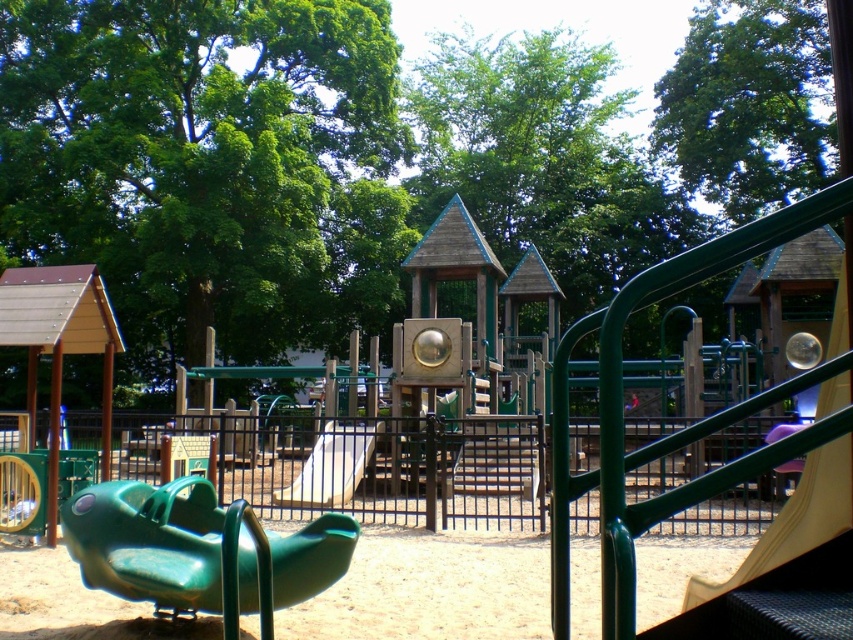
Question: Considering the relative positions of green plastic slide at lower left and white matte slide at center in the image provided, where is green plastic slide at lower left located with respect to white matte slide at center?

Choices:
 (A) right
 (B) left

Answer: (A)

Question: Can you confirm if green plastic slide at lower left is positioned below white matte slide at center?

Choices:
 (A) no
 (B) yes

Answer: (A)

Question: Which point appears closest to the camera in this image?

Choices:
 (A) (354, 483)
 (B) (207, 563)

Answer: (B)

Question: Which of the following is the closest to the observer?

Choices:
 (A) green plastic slide at lower left
 (B) white matte slide at center

Answer: (A)

Question: Can you confirm if green plastic slide at lower left is smaller than white matte slide at center?

Choices:
 (A) no
 (B) yes

Answer: (A)

Question: Which point is farther from the camera taking this photo?

Choices:
 (A) (315, 490)
 (B) (178, 572)

Answer: (A)